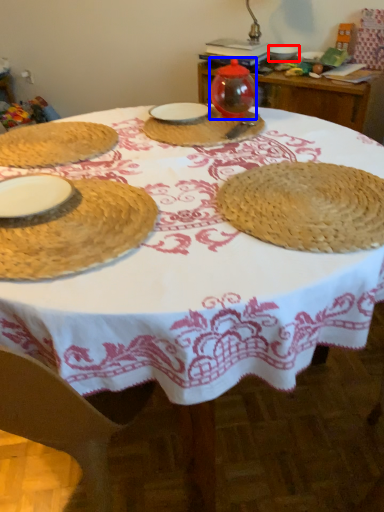
Question: Which of the following is the closest to the observer, tableware (highlighted by a red box) or tableware (highlighted by a blue box)?

Choices:
 (A) tableware
 (B) tableware

Answer: (B)